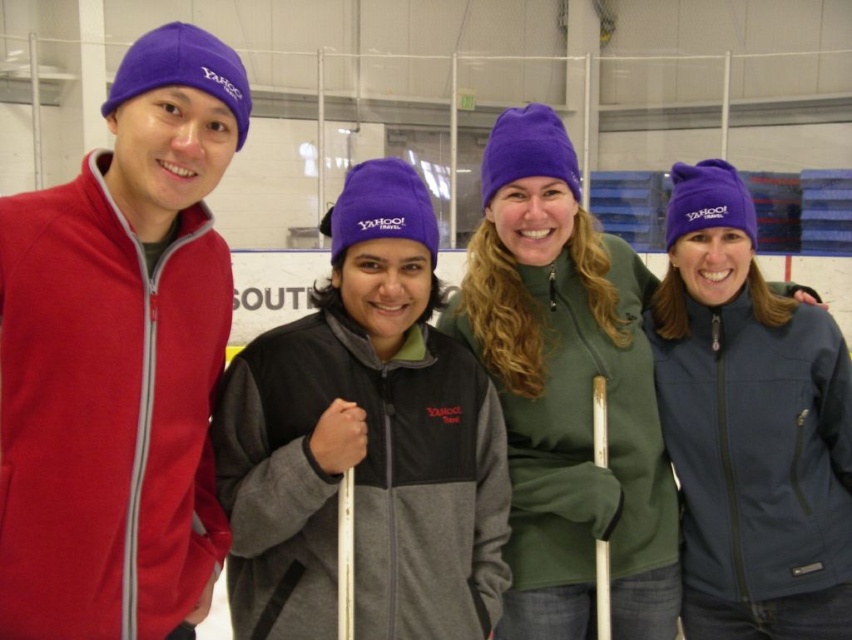
Does green fleece jacket at center appear under navy blue softshell jacket at right?

No, green fleece jacket at center is not below navy blue softshell jacket at right.

Can you confirm if green fleece jacket at center is positioned above navy blue softshell jacket at right?

Yes, green fleece jacket at center is above navy blue softshell jacket at right.

Find the location of a particular element. This screenshot has height=640, width=852. green fleece jacket at center is located at coordinates (567, 392).

Locate an element on the screen. green fleece jacket at center is located at coordinates (567, 392).

Between matte black jacket at center and navy blue softshell jacket at right, which one is positioned lower?

navy blue softshell jacket at right

Is point (444, 634) farther from viewer compared to point (711, 208)?

No, (444, 634) is in front of (711, 208).

This screenshot has height=640, width=852. Identify the location of matte black jacket at center. (366, 442).

Locate an element on the screen. This screenshot has width=852, height=640. matte black jacket at center is located at coordinates (366, 442).

Measure the distance from matte fleece jacket at left to navy blue softshell jacket at right.

matte fleece jacket at left is 1.47 meters from navy blue softshell jacket at right.

Which is above, matte fleece jacket at left or navy blue softshell jacket at right?

Positioned higher is matte fleece jacket at left.

Where is `matte fleece jacket at left`? matte fleece jacket at left is located at coordinates (119, 358).

I want to click on matte fleece jacket at left, so click(x=119, y=358).